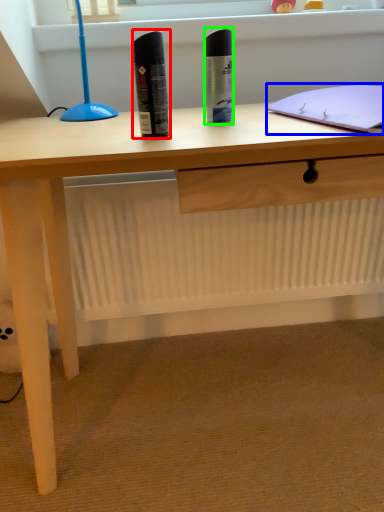
Question: Estimate the real-world distances between objects in this image. Which object is farther from stationery (highlighted by a red box), notebook (highlighted by a blue box) or stationery (highlighted by a green box)?

Choices:
 (A) notebook
 (B) stationery

Answer: (A)